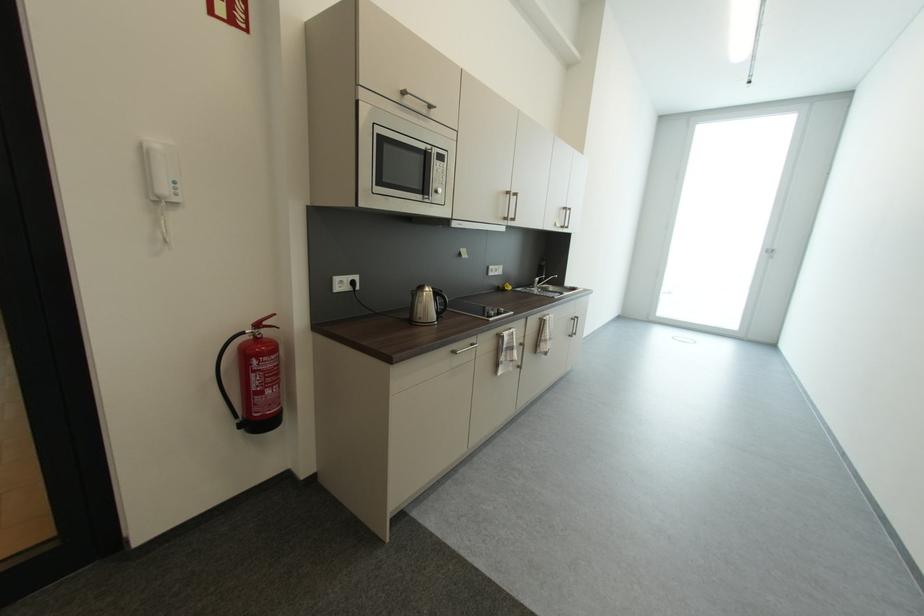
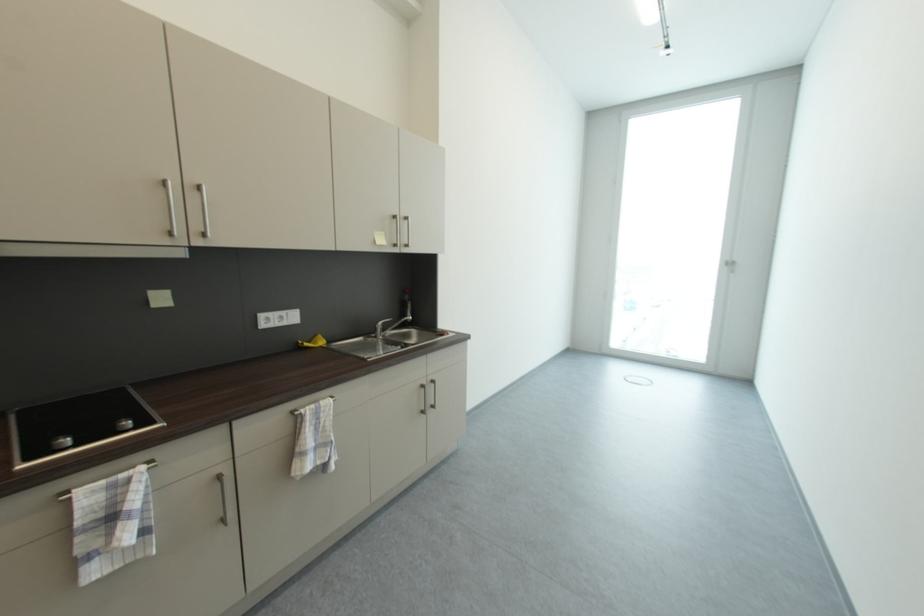
In a continuous first-person perspective shot, in which direction is the camera moving?

The cameraman moved toward right, forward.